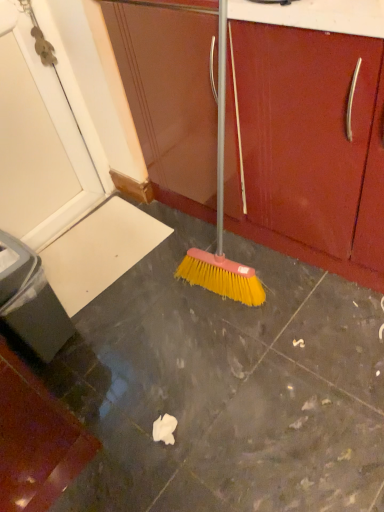
Describe the element at coordinates (304, 129) in the screenshot. I see `yellow bristle broom at center` at that location.

Identify the location of yellow bristle broom at center. pyautogui.click(x=304, y=129).

This screenshot has height=512, width=384. What do you see at coordinates (306, 148) in the screenshot? I see `matte wood cabinet at center` at bounding box center [306, 148].

Locate an element on the screen. matte wood cabinet at center is located at coordinates (306, 148).

The image size is (384, 512). Find the location of `yellow bristle broom at center`. yellow bristle broom at center is located at coordinates (304, 129).

Which object is positioned more to the left, yellow bristle broom at center or matte wood cabinet at center?

matte wood cabinet at center.

Considering their positions, is yellow bristle broom at center located in front of or behind matte wood cabinet at center?

yellow bristle broom at center is positioned closer to the viewer than matte wood cabinet at center.

Is point (305, 99) positioned behind point (191, 121)?

No, (305, 99) is closer to viewer.

From the image's perspective, is yellow bristle broom at center above or below matte wood cabinet at center?

Based on their image positions, yellow bristle broom at center is located beneath matte wood cabinet at center.

From a real-world perspective, is yellow bristle broom at center physically located above or below matte wood cabinet at center?

yellow bristle broom at center is situated lower than matte wood cabinet at center in the real world.

Is yellow bristle broom at center wider or thinner than matte wood cabinet at center?

In the image, yellow bristle broom at center appears to be wider than matte wood cabinet at center.

Considering the relative sizes of yellow bristle broom at center and matte wood cabinet at center in the image provided, is yellow bristle broom at center taller than matte wood cabinet at center?

In fact, yellow bristle broom at center may be shorter than matte wood cabinet at center.

Considering the relative sizes of yellow bristle broom at center and matte wood cabinet at center in the image provided, is yellow bristle broom at center bigger than matte wood cabinet at center?

Yes.

Is matte wood cabinet at center inside yellow bristle broom at center?

That's incorrect, matte wood cabinet at center is not inside yellow bristle broom at center.

Is yellow bristle broom at center beside matte wood cabinet at center?

Yes, yellow bristle broom at center and matte wood cabinet at center clearly make contact.

Is yellow bristle broom at center turned away from matte wood cabinet at center?

yellow bristle broom at center does not have its back to matte wood cabinet at center.

How far apart are yellow bristle broom at center and matte wood cabinet at center?

yellow bristle broom at center is 3.16 inches from matte wood cabinet at center.

Find the location of a particular element. The height and width of the screenshot is (512, 384). cabinetry positioned vertically above the yellow bristle broom at center (from a real-world perspective) is located at coordinates (306, 148).

In the scene shown: Is matte wood cabinet at center at the right side of yellow bristle broom at center?

No, matte wood cabinet at center is not to the right of yellow bristle broom at center.

Considering their positions, is matte wood cabinet at center located in front of or behind yellow bristle broom at center?

Visually, matte wood cabinet at center is located behind yellow bristle broom at center.

Which is in front, point (161, 178) or point (341, 48)?

Positioned in front is point (341, 48).

From the image's perspective, who appears lower, matte wood cabinet at center or yellow bristle broom at center?

yellow bristle broom at center.

From a real-world perspective, is matte wood cabinet at center positioned over yellow bristle broom at center based on gravity?

Indeed, from a real-world perspective, matte wood cabinet at center stands above yellow bristle broom at center.

Does matte wood cabinet at center have a greater width compared to yellow bristle broom at center?

No.

Is matte wood cabinet at center shorter than yellow bristle broom at center?

No.

Based on the photo, is matte wood cabinet at center bigger than yellow bristle broom at center?

No.

Looking at this image, is matte wood cabinet at center positioned beyond the bounds of yellow bristle broom at center?

Yes, matte wood cabinet at center is not within yellow bristle broom at center.

Is matte wood cabinet at center positioned far away from yellow bristle broom at center?

No, matte wood cabinet at center is in close proximity to yellow bristle broom at center.

Is yellow bristle broom at center at the back of matte wood cabinet at center?

No.

What are the coordinates of `cabinetry behind the yellow bristle broom at center` in the screenshot? It's located at (306, 148).

The width and height of the screenshot is (384, 512). What are the coordinates of `cabinetry located behind the yellow bristle broom at center` in the screenshot? It's located at (306, 148).

Locate an element on the screen. The image size is (384, 512). drawer below the matte wood cabinet at center (from the image's perspective) is located at coordinates pos(304,129).